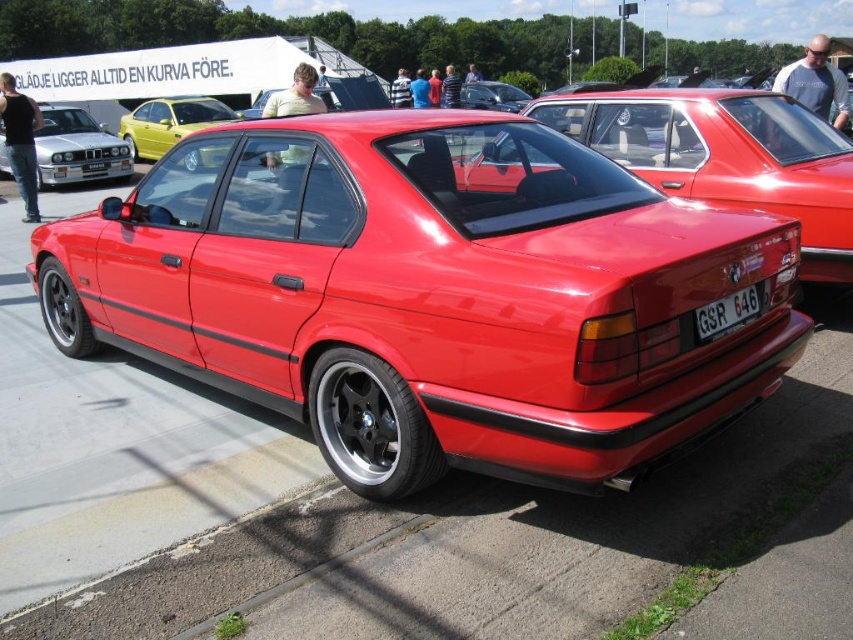
Who is higher up, matte silver car at left or metallic yellow car at upper left?

metallic yellow car at upper left is above.

What do you see at coordinates (77, 148) in the screenshot? Image resolution: width=853 pixels, height=640 pixels. I see `matte silver car at left` at bounding box center [77, 148].

The width and height of the screenshot is (853, 640). I want to click on matte silver car at left, so click(77, 148).

Measure the distance between glossy red car at center and metallic yellow car at upper left.

They are 13.15 meters apart.

Locate an element on the screen. This screenshot has height=640, width=853. glossy red car at center is located at coordinates (724, 156).

Is glossy red car at center below matte silver car at left?

Yes.

Between point (692, 100) and point (125, 172), which one is positioned behind?

Point (125, 172)

Is point (712, 160) farther from camera compared to point (50, 179)?

No, (712, 160) is in front of (50, 179).

Image resolution: width=853 pixels, height=640 pixels. I want to click on glossy red car at center, so (x=724, y=156).